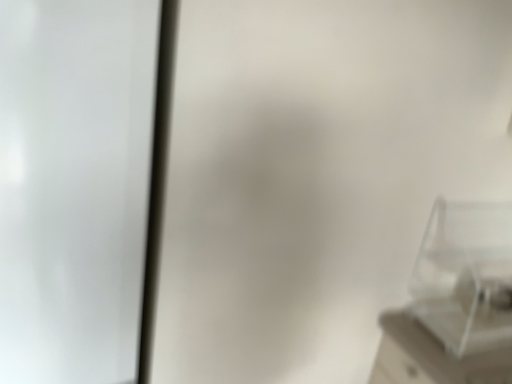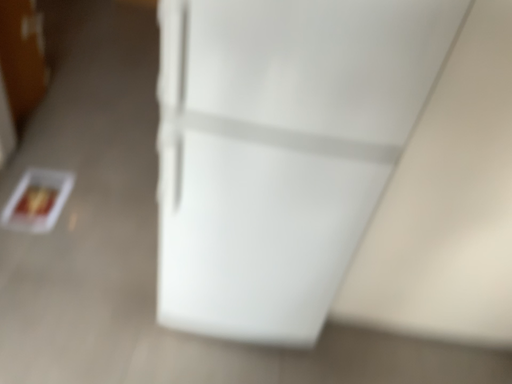
Question: Which way did the camera rotate in the video?

Choices:
 (A) rotated right
 (B) rotated left

Answer: (B)